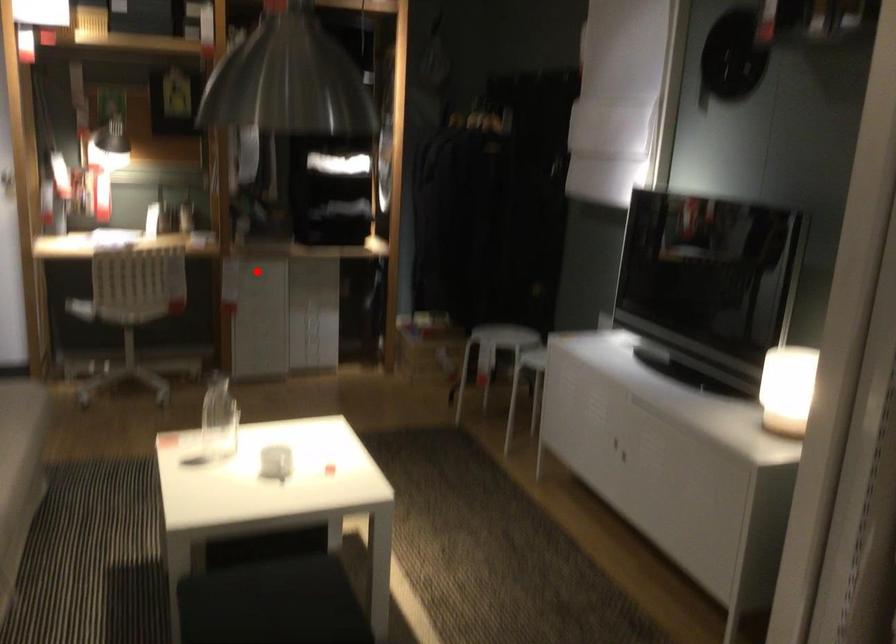
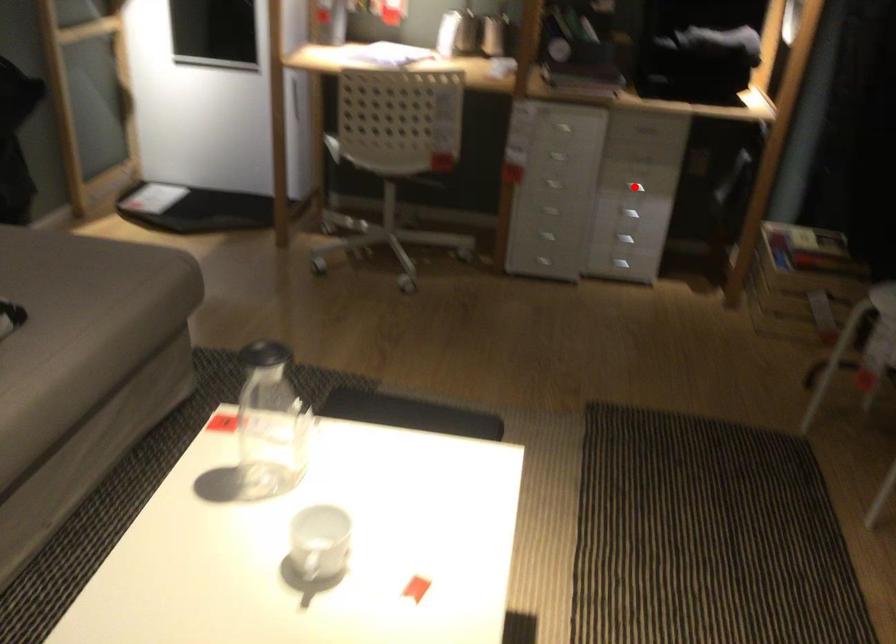
I am providing you with two images of the same scene from different viewpoints. A red point is marked on the first image and another point is marked on the second image. Do the highlighted points in image1 and image2 indicate the same real-world spot?

No